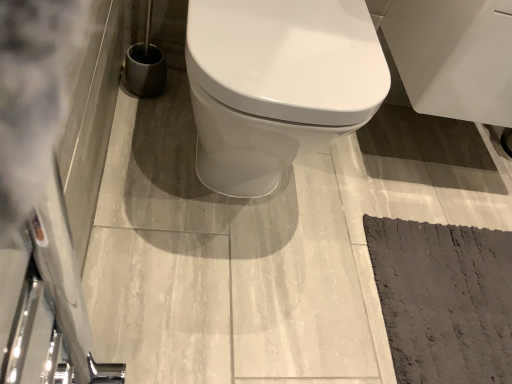
Identify the location of vacant space situated on the left part of dark gray textured mat at lower right. The width and height of the screenshot is (512, 384). [305, 254].